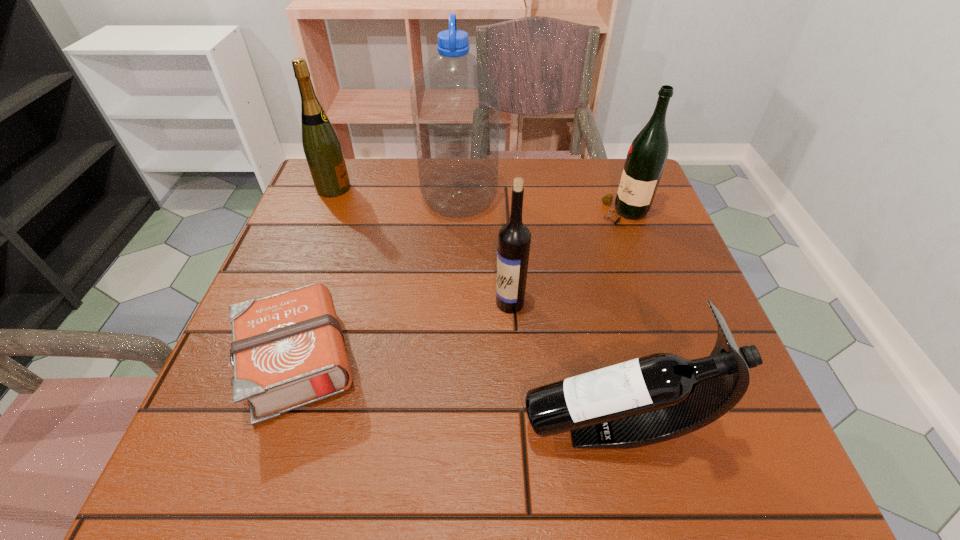
Identify the location of water jug. This screenshot has width=960, height=540. (455, 100).

Find the location of a particular element. The image size is (960, 540). the farthest wine bottle is located at coordinates 322,148.

What are the coordinates of `the second farthest wine bottle` in the screenshot? It's located at (646, 158).

Locate an element on the screen. the third farthest wine bottle is located at coordinates (514, 238).

Identify the location of the nearest wine bottle. (662, 396).

Where is `Bible`? This screenshot has height=540, width=960. Bible is located at coordinates (288, 351).

Locate an element on the screen. Image resolution: width=960 pixels, height=540 pixels. free space located 0.220m on the front of the water jug is located at coordinates (454, 292).

I want to click on vacant area located 0.240m on the front-facing side of the leftmost wine bottle, so 442,188.

Locate an element on the screen. This screenshot has width=960, height=540. vacant space located 0.290m on the surface of the second farthest wine bottle is located at coordinates (483, 212).

Identify the location of vacant region located on the surface of the second farthest wine bottle. The image size is (960, 540). (439, 212).